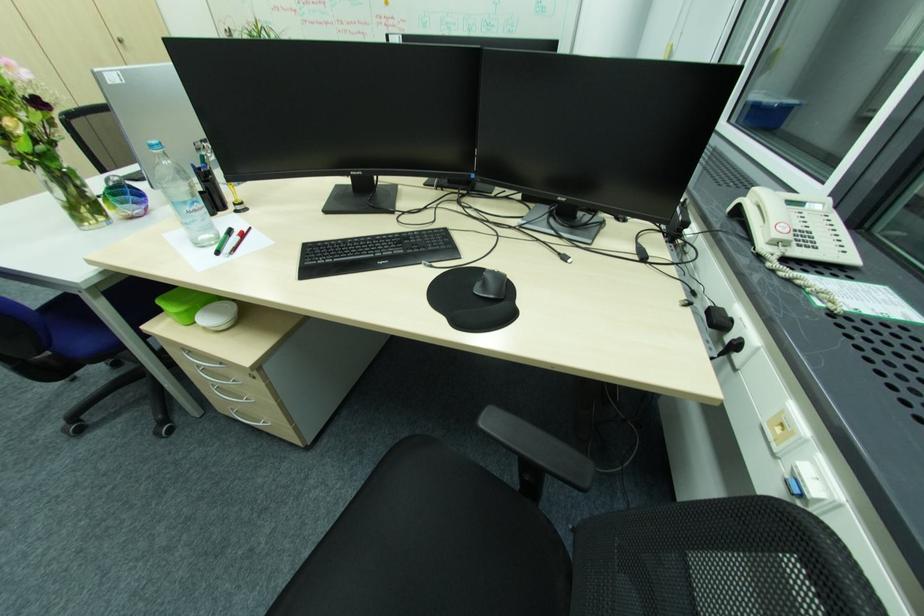
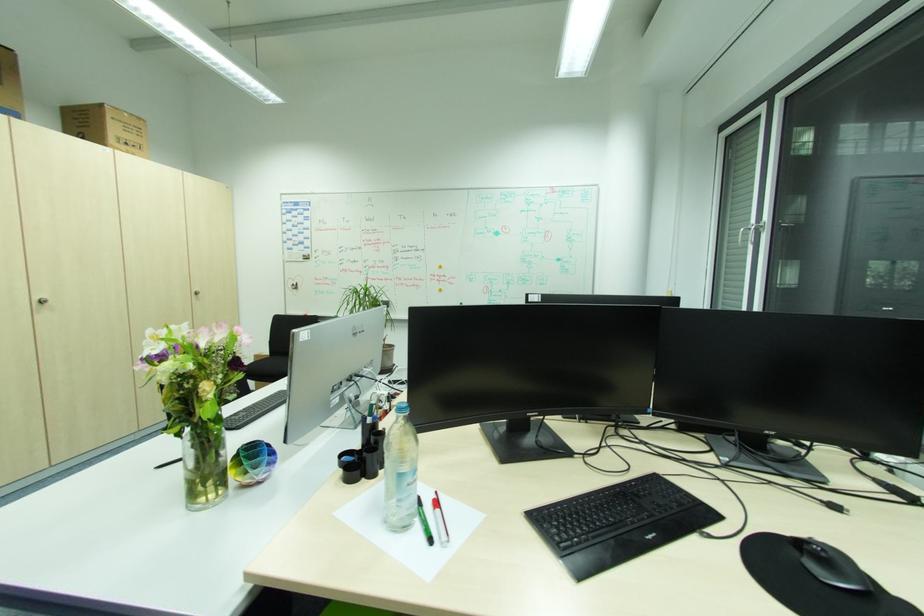
Where in the second image is the point corresponding to point 92,224 from the first image?

(208, 500)